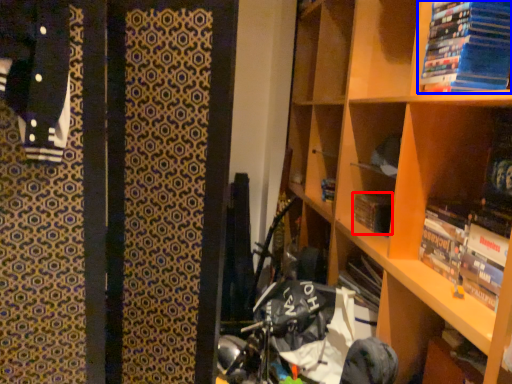
Question: Which of the following is the farthest to the observer, paperback book (highlighted by a red box) or book (highlighted by a blue box)?

Choices:
 (A) paperback book
 (B) book

Answer: (A)